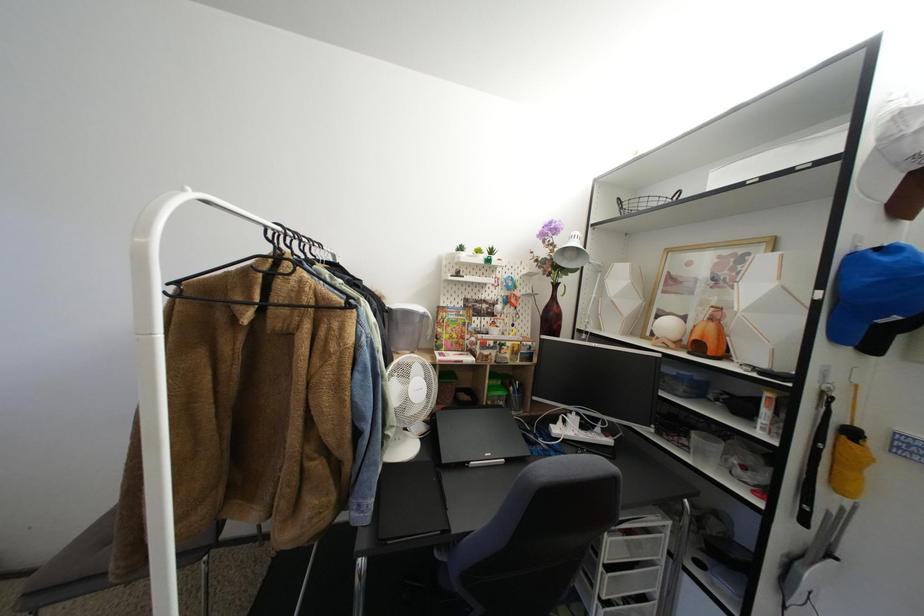
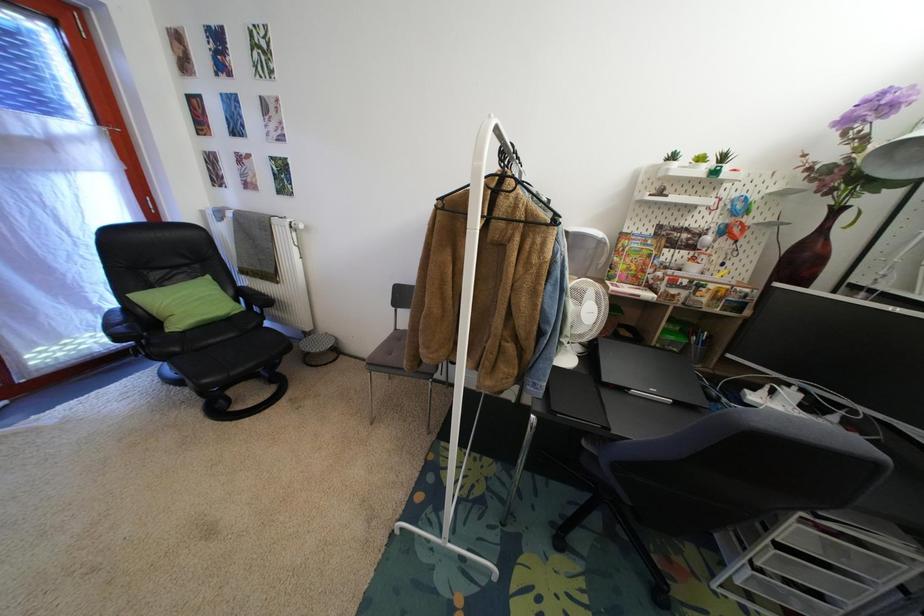
First-person continuous shooting, in which direction is the camera rotating?

The camera rotated toward left-down.